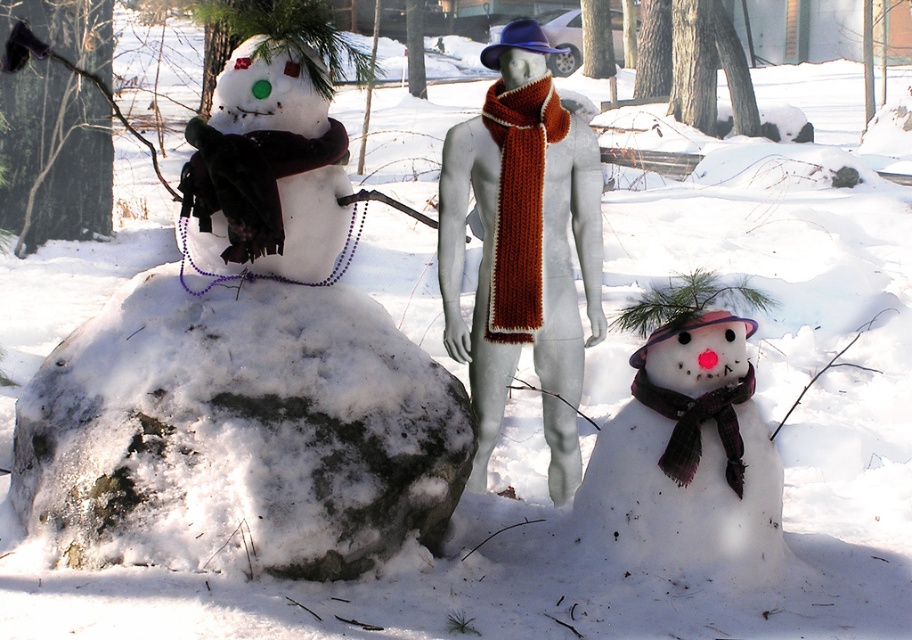
You are a child who wants to build a snowman taller than the matte black scarf at left. Can you do it with the white fluffy snowman at left?

The white fluffy snowman at left is larger in size than the matte black scarf at left, so yes, the snowman is taller than the scarf.